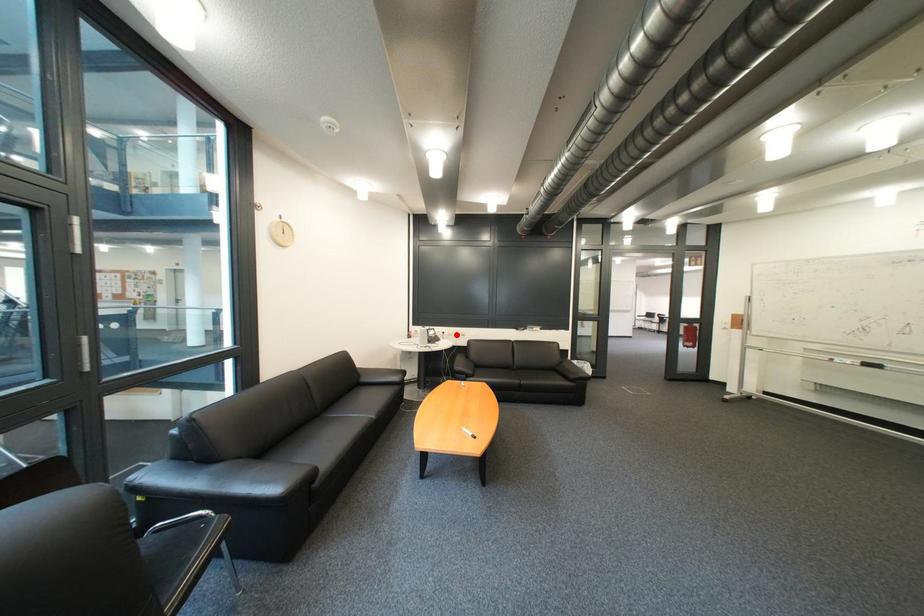
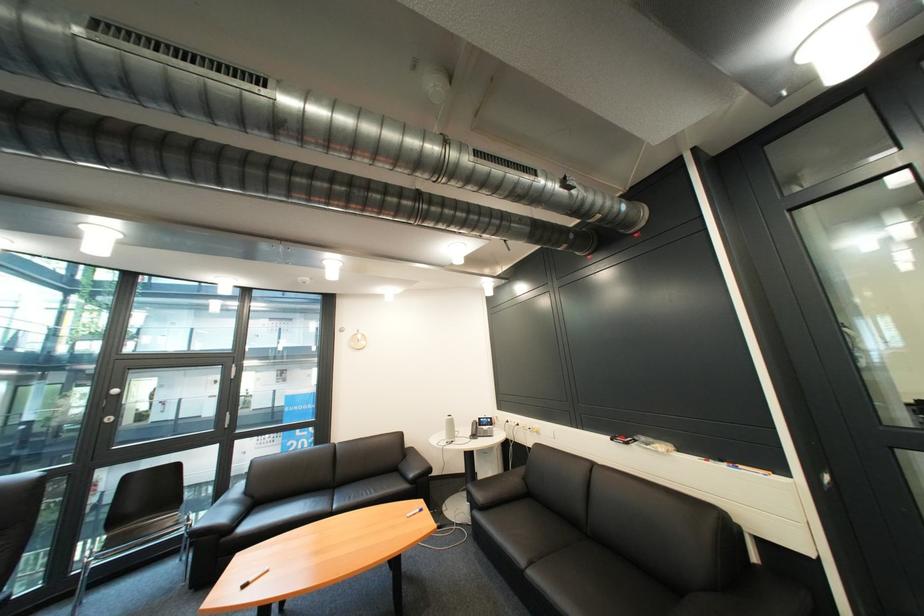
Question: I am providing you with two images of the same scene from different viewpoints. In image1, a red point is highlighted. Considering the same 3D point in image2, which of the following is correct?

Choices:
 (A) It is closer
 (B) It is farther

Answer: (B)